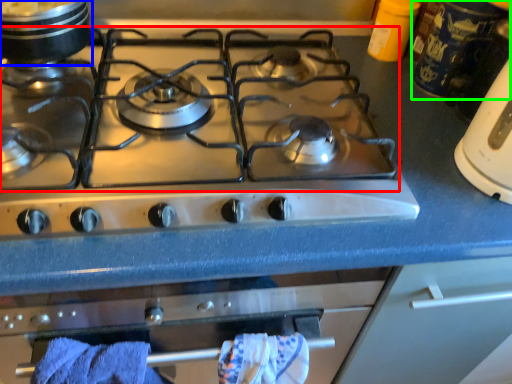
Question: Considering the real-world distances, which object is farthest from gas stove (highlighted by a red box)? kitchen appliance (highlighted by a blue box) or appliance (highlighted by a green box)?

Choices:
 (A) kitchen appliance
 (B) appliance

Answer: (B)